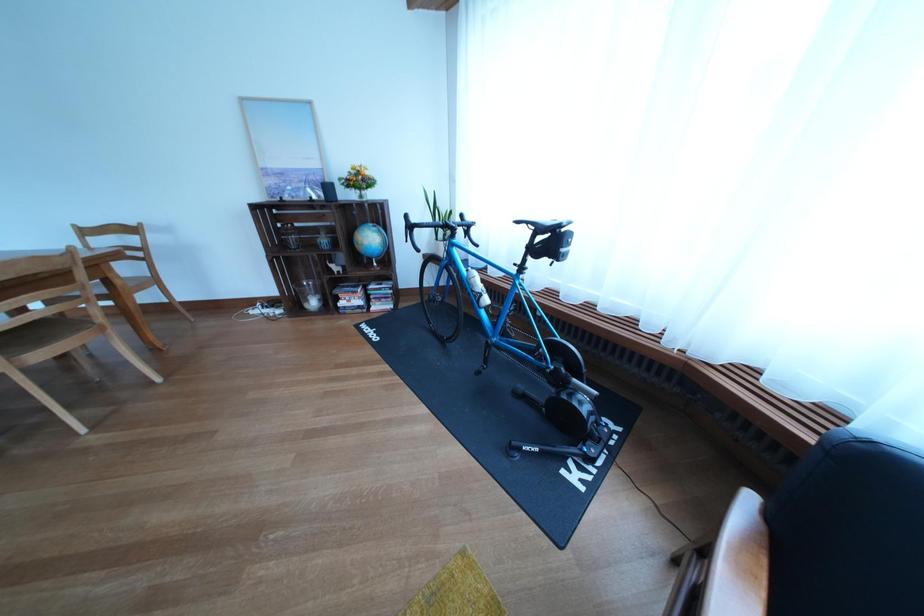
Image resolution: width=924 pixels, height=616 pixels. What do you see at coordinates (491, 377) in the screenshot?
I see `the bicycle pedal` at bounding box center [491, 377].